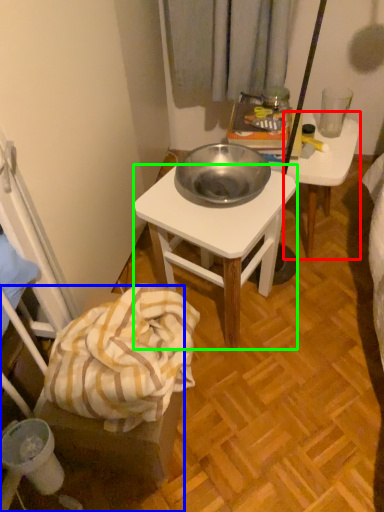
Question: Which is farther away from table (highlighted by a red box)? chair (highlighted by a blue box) or desk (highlighted by a green box)?

Choices:
 (A) chair
 (B) desk

Answer: (A)